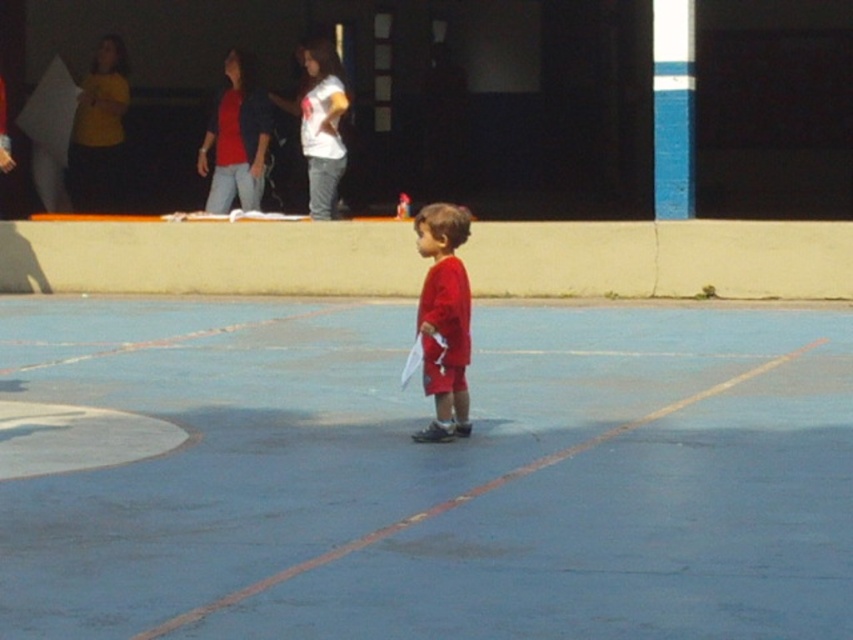
Question: Which point is farther from the camera taking this photo?

Choices:
 (A) (189, 352)
 (B) (445, 204)

Answer: (A)

Question: Which point is closer to the camera?

Choices:
 (A) blue rubber basketball court at center
 (B) matte red shorts at center

Answer: (A)

Question: Can you confirm if blue rubber basketball court at center is bigger than matte red shorts at center?

Choices:
 (A) yes
 (B) no

Answer: (A)

Question: Can you confirm if blue rubber basketball court at center is positioned below matte red shorts at center?

Choices:
 (A) yes
 (B) no

Answer: (A)

Question: Observing the image, what is the correct spatial positioning of blue rubber basketball court at center in reference to matte red shorts at center?

Choices:
 (A) above
 (B) below

Answer: (B)

Question: Which of the following is the closest to the observer?

Choices:
 (A) matte red shorts at center
 (B) blue rubber basketball court at center

Answer: (B)